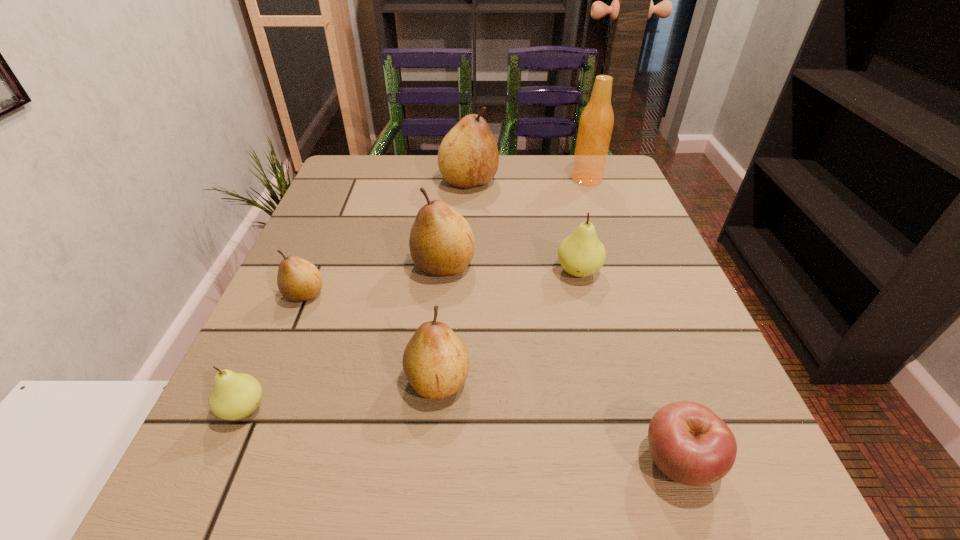
In order to click on vacant space at the left edge of the desktop in this screenshot , I will do `click(347, 248)`.

The width and height of the screenshot is (960, 540). In order to click on free space at the right edge of the desktop in this screenshot , I will do `click(601, 316)`.

Find the location of a particular element. Image resolution: width=960 pixels, height=540 pixels. vacant space at the far left corner of the desktop is located at coordinates (399, 155).

Find the location of a particular element. free location at the near left corner of the desktop is located at coordinates (203, 487).

Where is `vacant space at the far right corner`? vacant space at the far right corner is located at coordinates (624, 189).

At what (x,y) coordinates should I click in order to perform the action: click on blank space at the near right corner of the desktop. Please return your answer as a coordinate pair (x, y). This screenshot has height=540, width=960. Looking at the image, I should click on (750, 498).

Locate an element on the screen. Image resolution: width=960 pixels, height=540 pixels. free point between the tallest object and the third biggest brown pear is located at coordinates (513, 280).

Identify the location of vacant point located between the third smallest brown pear and the right green pear. 511,268.

Where is `empty space between the leftmost brown pear and the second smallest brown pear`? empty space between the leftmost brown pear and the second smallest brown pear is located at coordinates (372, 338).

Locate an element on the screen. The width and height of the screenshot is (960, 540). empty location between the third smallest brown pear and the smallest brown pear is located at coordinates (374, 280).